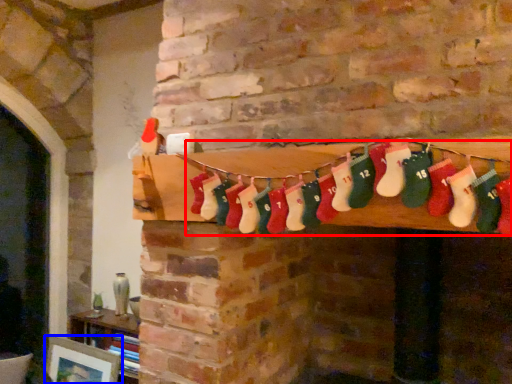
Question: Among these objects, which one is farthest to the camera, sock (highlighted by a red box) or picture frame (highlighted by a blue box)?

Choices:
 (A) sock
 (B) picture frame

Answer: (B)